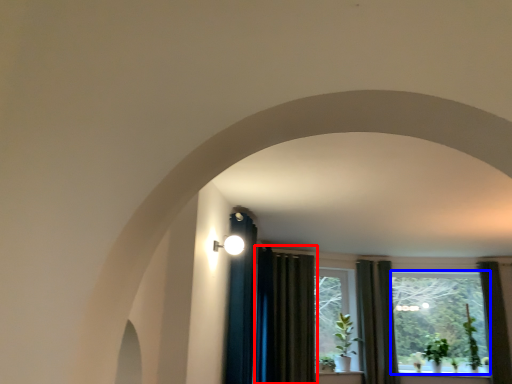
Question: Which object appears farthest to the camera in this image, curtain (highlighted by a red box) or window screen (highlighted by a blue box)?

Choices:
 (A) curtain
 (B) window screen

Answer: (B)